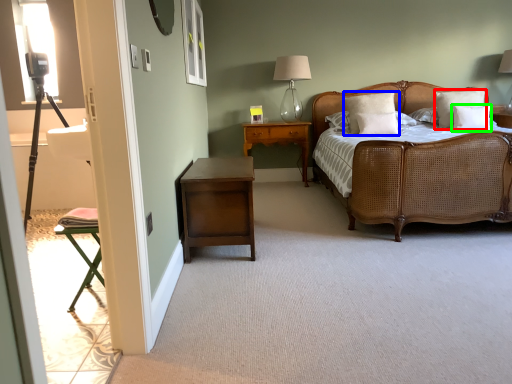
Question: Considering the real-world distances, which object is farthest from pillow (highlighted by a red box)? pillow (highlighted by a blue box) or pillow (highlighted by a green box)?

Choices:
 (A) pillow
 (B) pillow

Answer: (A)